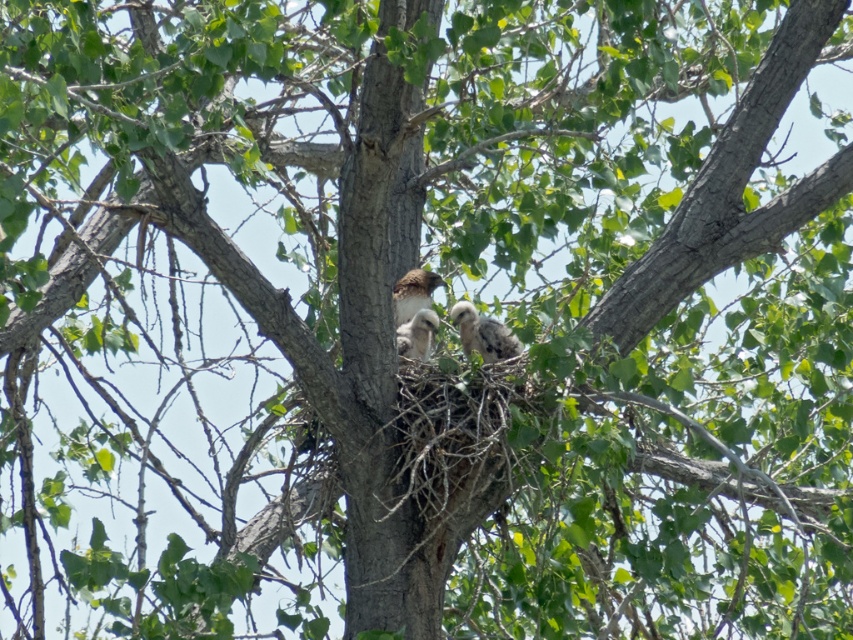
You are a birdwatcher observing the tree from below. You notice the speckled feathered chick at center and the brown speckled feathers at center. Which object is located above the other?

The brown speckled feathers at center are above the speckled feathered chick at center because the chick is positioned under them.

You are a birdwatcher observing the tree with the nest. You notice the speckled feathered chick at center and the brown speckled feathers at center. Which object is positioned in front of the other?

The speckled feathered chick at center is closer to the viewer than the brown speckled feathers at center, so the speckled feathered chick at center is positioned in front of the brown speckled feathers at center.